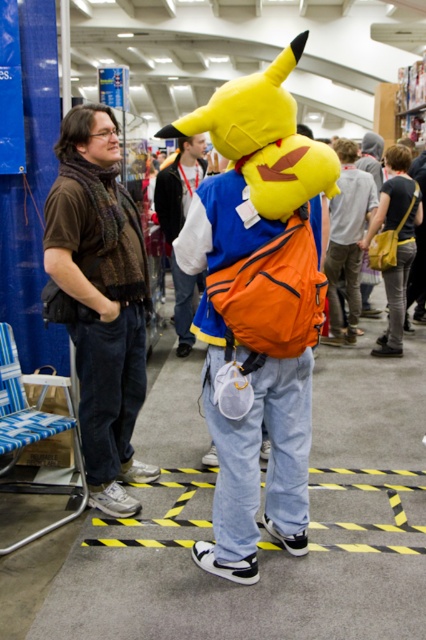
In the scene shown: You are a photographer at the event and want to capture a photo where both the brown woven scarf at left and the orange fabric backpack at center are visible. Since the scarf is taller than the backpack, which object should you ensure is positioned lower in the frame to avoid blocking the other?

The orange fabric backpack at center should be positioned lower in the frame since the brown woven scarf at left is taller, allowing both objects to be visible without obstruction.

You are organizing a costume party and need to decide which item to place in a narrow display case. The case can only accommodate items that are not too thick. Which item between the brown woven scarf at left and the orange fabric backpack at center would you choose?

The brown woven scarf at left is thinner than the orange fabric backpack at center, so it would fit better in the narrow display case.

You are a photographer at the event and need to capture a clear shot of the orange fabric backpack at center without the denim pants at center blocking it. How can you adjust your camera angle to ensure the backpack is fully visible?

Since the denim pants at center are positioned over the orange fabric backpack at center, you should lower your camera angle to look underneath the denim pants at center and frame the orange fabric backpack at center directly.